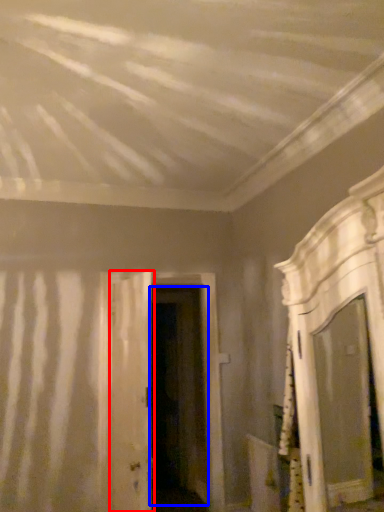
Question: Which point is further to the camera, door (highlighted by a red box) or door (highlighted by a blue box)?

Choices:
 (A) door
 (B) door

Answer: (B)